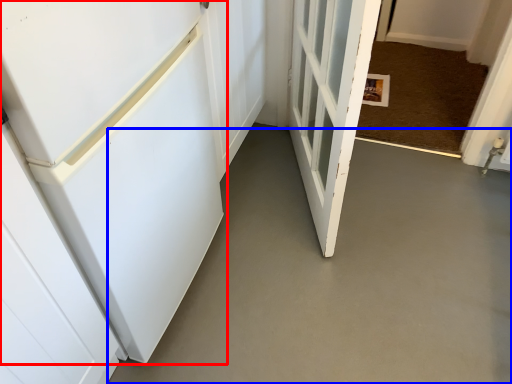
Question: Which of the following is the farthest to the observer, door (highlighted by a red box) or concrete (highlighted by a blue box)?

Choices:
 (A) door
 (B) concrete

Answer: (A)